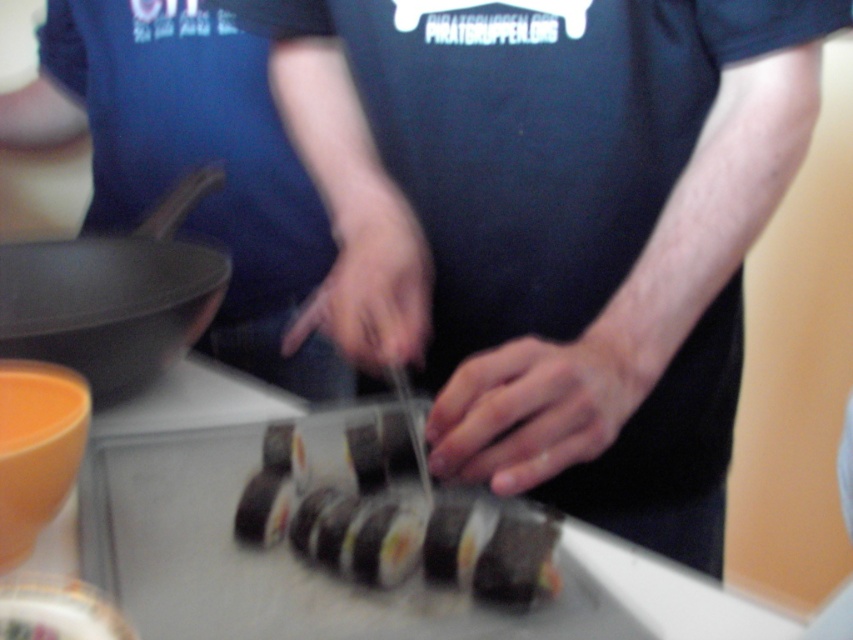
You are a food critic standing in front of the scene. You want to take a photo of the black matte sushi at center and the matte black frying pan at left. Which object will appear larger in your photo?

The black matte sushi at center will appear larger in the photo because it is closer to the viewer than the matte black frying pan at left.